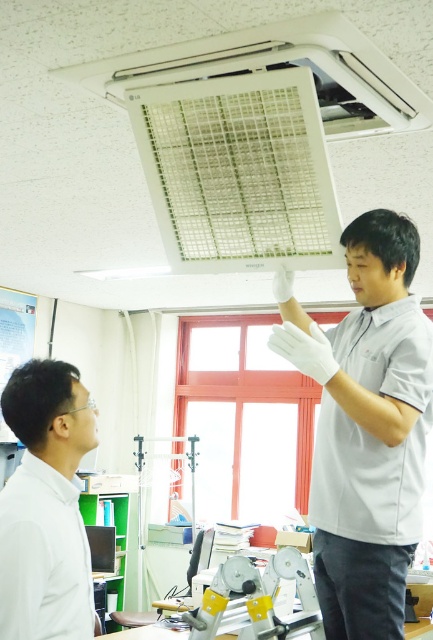
You are a safety inspector in the lab. You need to check if the distance between the white matte gloves at upper center and the white plastic exhaust hood at upper center meets the safety standard of 1 meter. Is the distance sufficient?

The distance between the white matte gloves at upper center and the white plastic exhaust hood at upper center is 1.06 meters, which exceeds the 1 meter safety standard. Therefore, the distance is sufficient.

What is located at the coordinates point (45, 506) in the image?

The white matte shirt at upper left is located at point (45, 506).

You are standing in the laboratory and need to reach both points in the scene. Which point, point (291, 336) or point (35, 412), is closer to you?

Point (291, 336) is closer to you because it is further to the viewer than point (35, 412).